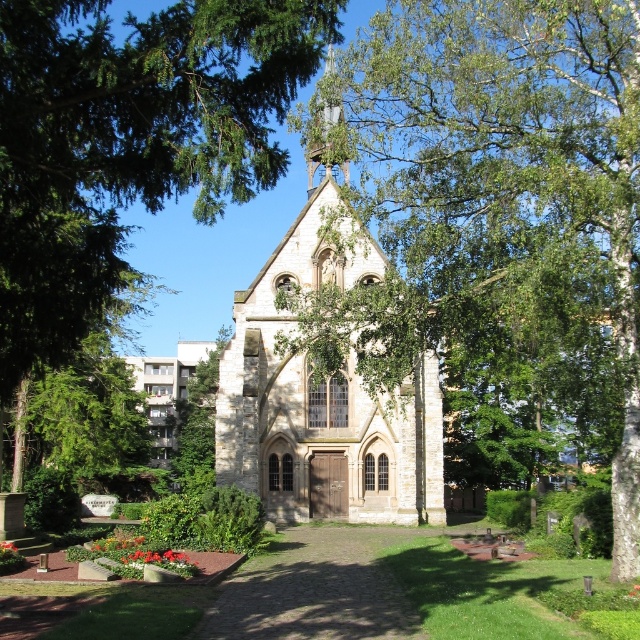
You are standing at the entrance of the historic stone church and looking towards the green leafy tree at center and the green leafy tree at upper left. Which tree appears closer to you?

The green leafy tree at center appears closer to you because the green leafy tree at upper left is behind it.